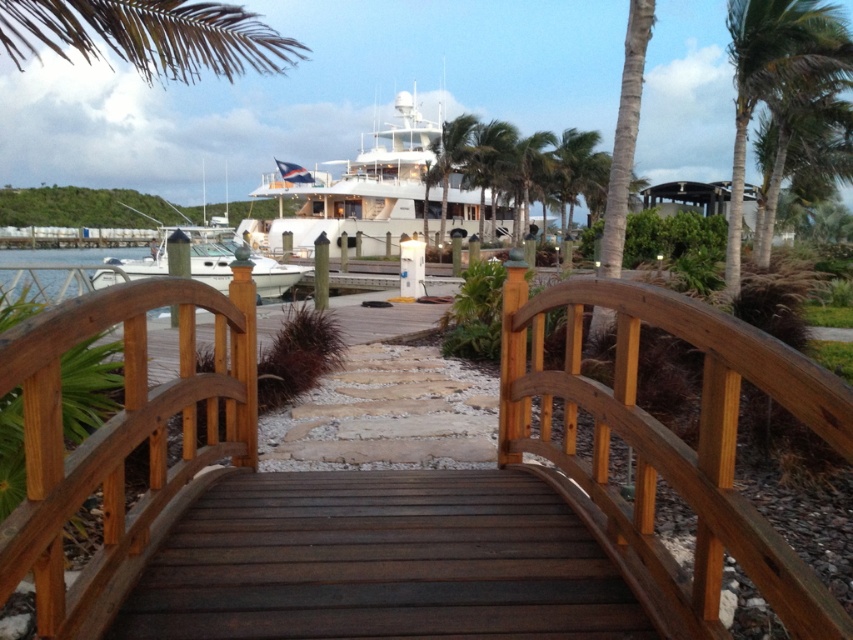
Is green leafy palm tree at upper right below green leafy palm tree at upper center?

Indeed, green leafy palm tree at upper right is positioned under green leafy palm tree at upper center.

Can you confirm if green leafy palm tree at upper right is positioned to the left of green leafy palm tree at upper center?

Indeed, green leafy palm tree at upper right is positioned on the left side of green leafy palm tree at upper center.

You are a GUI agent. You are given a task and a screenshot of the screen. Output one action in this format:
    pyautogui.click(x=<x>, y=<y>)
    Task: Click on the green leafy palm tree at upper right
    The width and height of the screenshot is (853, 640).
    Given the screenshot: What is the action you would take?
    pyautogui.click(x=775, y=76)

At what (x,y) coordinates should I click in order to perform the action: click on green leafy palm tree at upper right. Please return your answer as a coordinate pair (x, y). Image resolution: width=853 pixels, height=640 pixels. Looking at the image, I should click on (775, 76).

Can you confirm if green leafy palm tree at upper right is positioned to the right of white glossy boat at center?

Yes, green leafy palm tree at upper right is to the right of white glossy boat at center.

Is point (837, 28) behind point (200, 266)?

That is False.

Where is `green leafy palm tree at upper right`? green leafy palm tree at upper right is located at coordinates (775, 76).

Who is positioned more to the left, brown wooden bridge at center or green leafy palm tree at upper right?

Positioned to the left is brown wooden bridge at center.

Is point (42, 365) less distant than point (749, 6)?

Yes, point (42, 365) is in front of point (749, 6).

Find the location of a particular element. The height and width of the screenshot is (640, 853). brown wooden bridge at center is located at coordinates (668, 449).